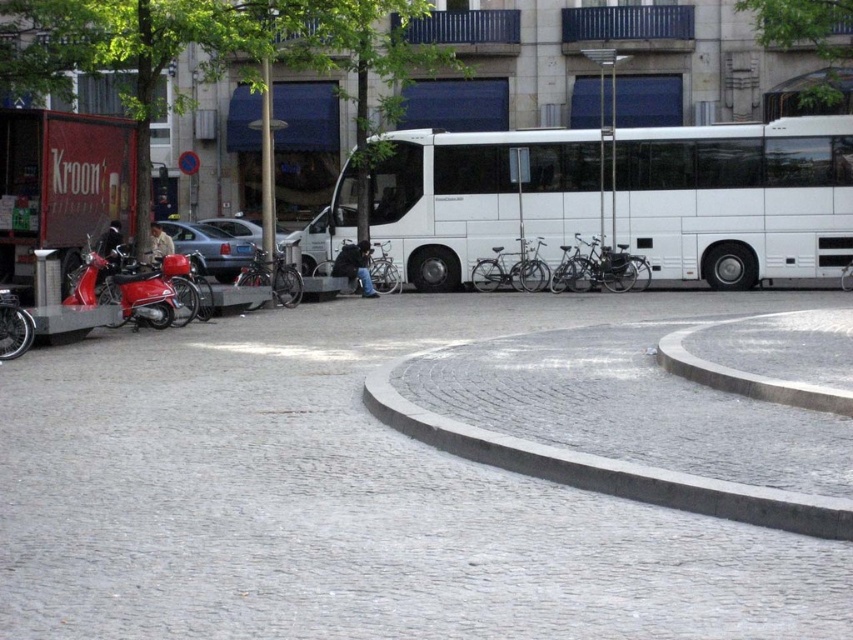
Question: Can you confirm if gray cobblestone pavement at center is positioned above white glossy bus at center?

Choices:
 (A) no
 (B) yes

Answer: (A)

Question: Can you confirm if gray cobblestone pavement at center is thinner than gray concrete curb at lower center?

Choices:
 (A) no
 (B) yes

Answer: (A)

Question: Is gray cobblestone pavement at center further to camera compared to gray concrete curb at lower center?

Choices:
 (A) yes
 (B) no

Answer: (B)

Question: Which point is closer to the camera?

Choices:
 (A) tap(715, 493)
 (B) tap(334, 544)

Answer: (B)

Question: Which object is closer to the camera taking this photo?

Choices:
 (A) gray cobblestone pavement at center
 (B) white glossy bus at center

Answer: (A)

Question: Among these points, which one is nearest to the camera?

Choices:
 (A) (387, 188)
 (B) (376, 308)
 (C) (677, 348)

Answer: (C)